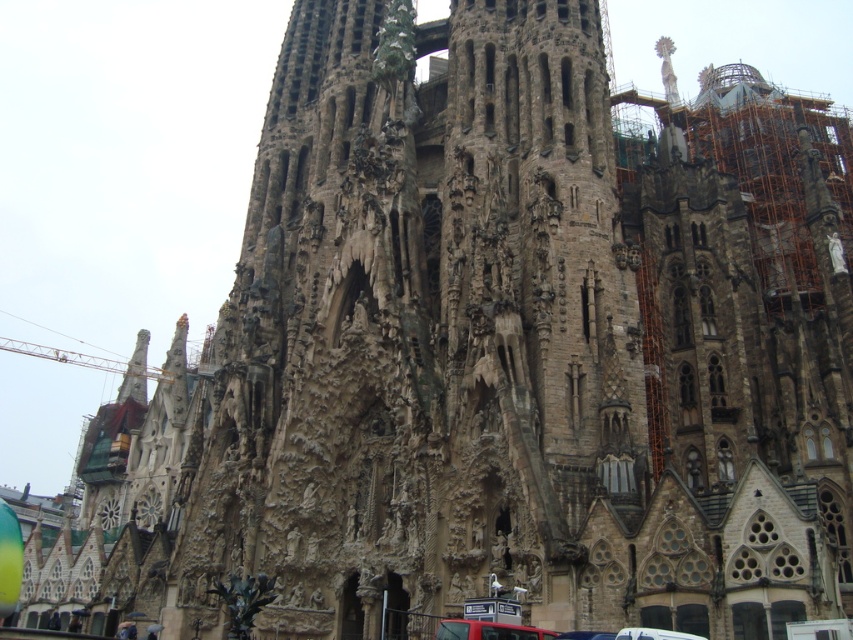
You are a tour guide explaining the Sagrada Familia to visitors. You point out two cars parked at the lower center of the scene. Which car is shorter between the matte red car at lower center and the white plastic car at lower center?

The matte red car at lower center is shorter than the white plastic car at lower center according to the description.

You are driving a matte red car at lower center and want to park it in a spot marked by point [488,630]. Is the car already positioned at that parking spot?

Yes, the point [488,630] marks the location of the matte red car at lower center, so the car is already parked at that spot.